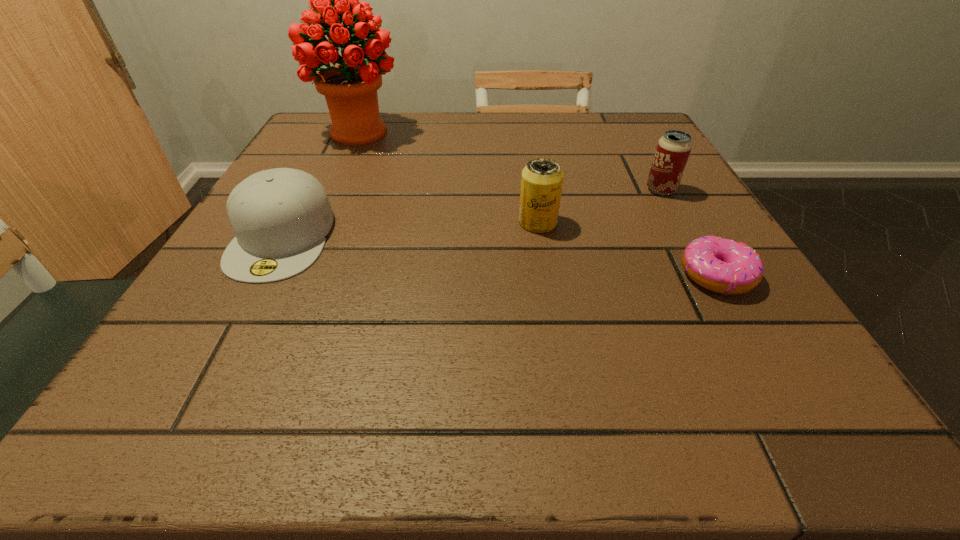
The image size is (960, 540). I want to click on free location at the near edge of the desktop, so click(x=412, y=377).

You are a GUI agent. You are given a task and a screenshot of the screen. Output one action in this format:
    pyautogui.click(x=<x>, y=<y>)
    Task: Click on the vacant space at the left edge
    This screenshot has width=960, height=540.
    Given the screenshot: What is the action you would take?
    pyautogui.click(x=317, y=165)

Find the location of a particular element. The width and height of the screenshot is (960, 540). free space at the right edge of the desktop is located at coordinates (723, 303).

Where is `free spot at the far left corner of the desktop`? The height and width of the screenshot is (540, 960). free spot at the far left corner of the desktop is located at coordinates [x=329, y=149].

Locate an element on the screen. This screenshot has height=540, width=960. free space at the far right corner of the desktop is located at coordinates (587, 119).

I want to click on unoccupied position between the third object from left to right and the farther beer can, so click(x=599, y=206).

At what (x,y) coordinates should I click in order to perform the action: click on vacant space that's between the cap and the shortest object. Please return your answer as a coordinate pair (x, y). The height and width of the screenshot is (540, 960). Looking at the image, I should click on (499, 256).

At what (x,y) coordinates should I click in order to perform the action: click on free space that is in between the cap and the nearer beer can. Please return your answer as a coordinate pair (x, y). Looking at the image, I should click on (410, 230).

You are a GUI agent. You are given a task and a screenshot of the screen. Output one action in this format:
    pyautogui.click(x=<x>, y=<y>)
    Task: Click on the vacant area between the fourth nearest object and the doughnut
    The height and width of the screenshot is (540, 960).
    Given the screenshot: What is the action you would take?
    pyautogui.click(x=688, y=233)

Image resolution: width=960 pixels, height=540 pixels. Find the location of `free space between the nearer beer can and the tallest object`. free space between the nearer beer can and the tallest object is located at coordinates (448, 177).